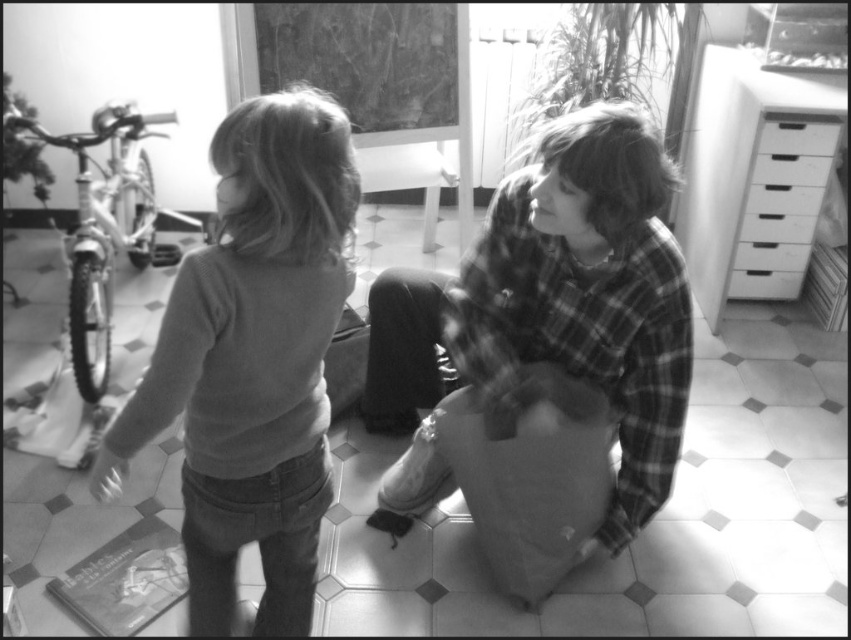
Consider the image. You are organizing a small toy collection. You have a smooth gray sweater at center and a white plastic drawers at right. Which object has a greater width?

The smooth gray sweater at center has a greater width than the white plastic drawers at right.

You are organizing a small toy car that is 10 cm long. You want to place it either on the smooth gray sweater at center or the white plastic drawers at right. Which surface can you place it on without the toy car hanging over the edge?

The smooth gray sweater at center is in front of the white plastic drawers at right, so the toy car can be placed on the smooth gray sweater at center since it is in front and likely has enough space.

You are organizing a small toy that is 10 cm tall. You want to place it on top of either the flannel shirt at center or the white plastic drawer at upper right. Which object can it fit on top of without falling off?

The toy can be placed on top of the flannel shirt at center because it is taller than the white plastic drawer at upper right, providing a more stable surface for the toy.